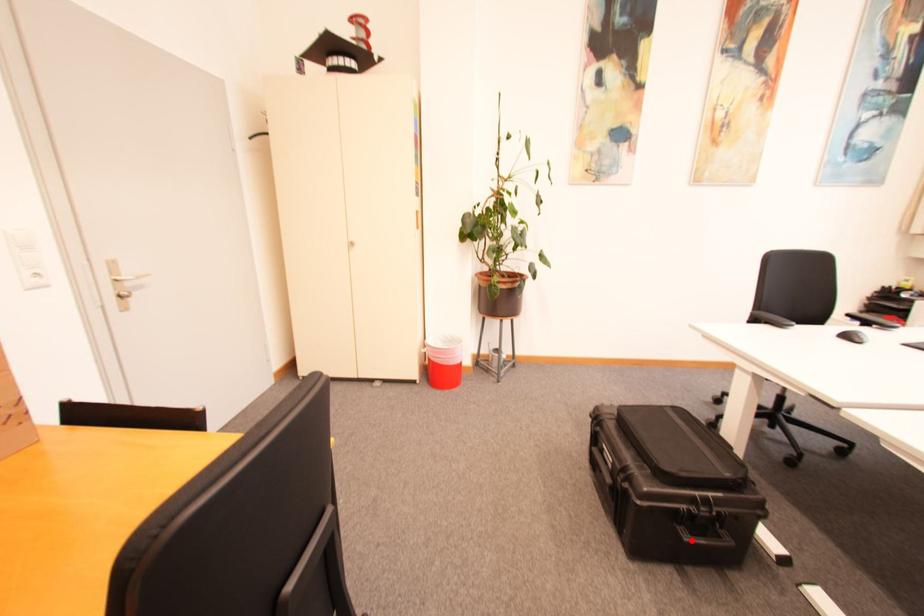
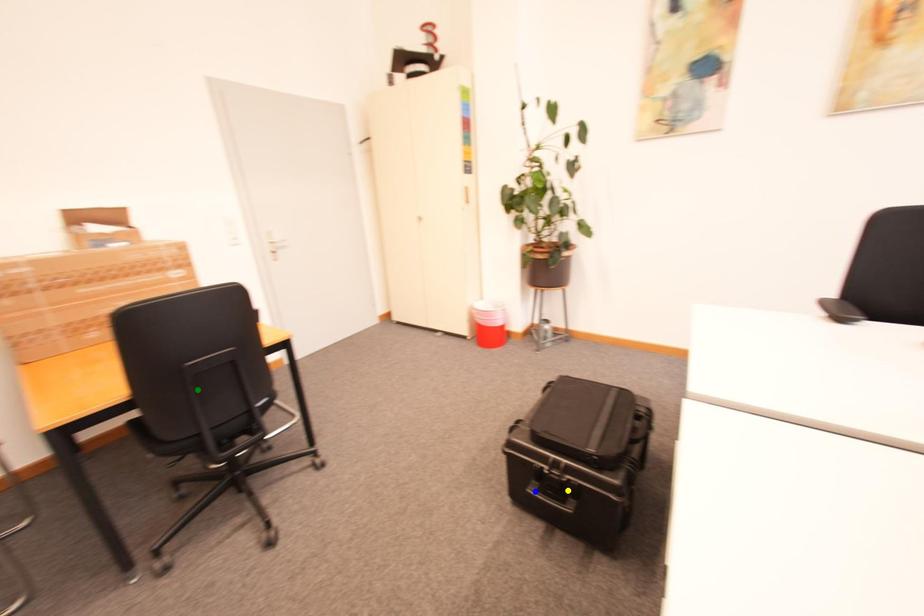
Question: I am providing you with two images of the same scene from different viewpoints. A red point is marked on the first image. You are given multiple points on the second image. Which spot in image 2 lines up with the point in image 1?

Choices:
 (A) blue point
 (B) yellow point
 (C) green point

Answer: (A)